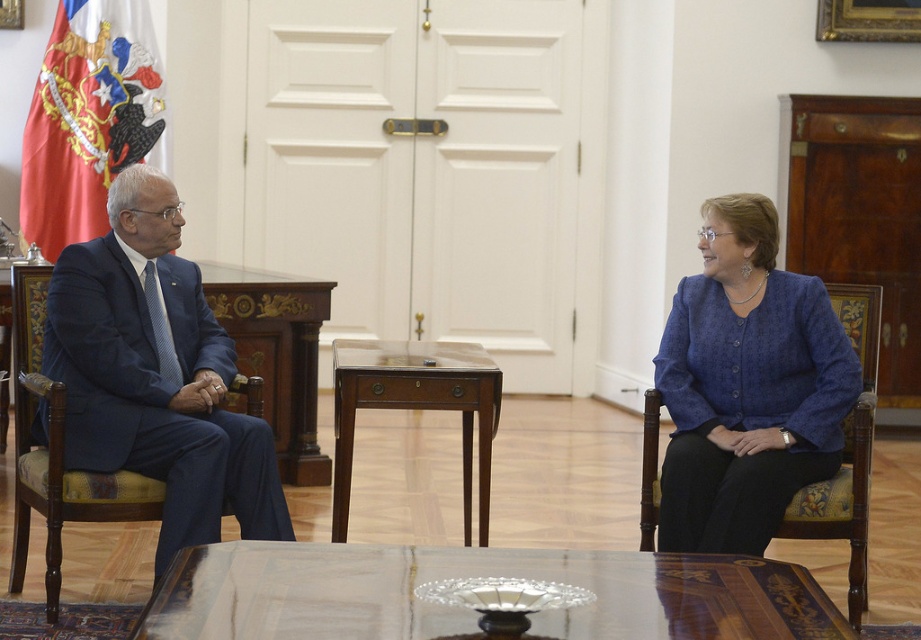
Question: Can you confirm if blue textured blazer at right is positioned to the right of mahogany wood side table at center?

Choices:
 (A) yes
 (B) no

Answer: (A)

Question: Which of the following is the farthest from the observer?

Choices:
 (A) wooden polished table at center
 (B) blue textured blazer at right
 (C) mahogany wood side table at center

Answer: (C)

Question: Estimate the real-world distances between objects in this image. Which object is closer to the wooden polished table at center?

Choices:
 (A) blue textured blazer at right
 (B) matte blue suit at left

Answer: (A)

Question: Is wooden polished table at center to the left of blue textured blazer at right from the viewer's perspective?

Choices:
 (A) no
 (B) yes

Answer: (B)

Question: Which of the following is the closest to the observer?

Choices:
 (A) (482, 488)
 (B) (170, 477)
 (C) (681, 627)

Answer: (C)

Question: Does wooden polished table at center appear over blue textured blazer at right?

Choices:
 (A) no
 (B) yes

Answer: (A)